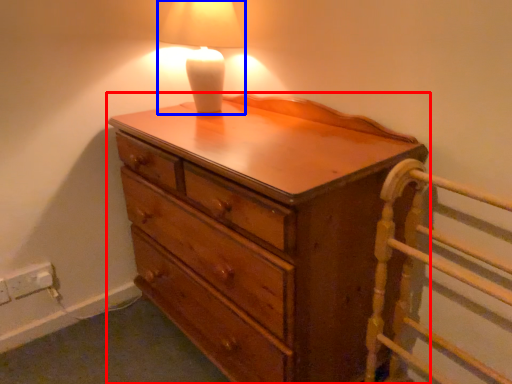
Question: Which point is further to the camera, chest of drawers (highlighted by a red box) or lamp (highlighted by a blue box)?

Choices:
 (A) chest of drawers
 (B) lamp

Answer: (B)